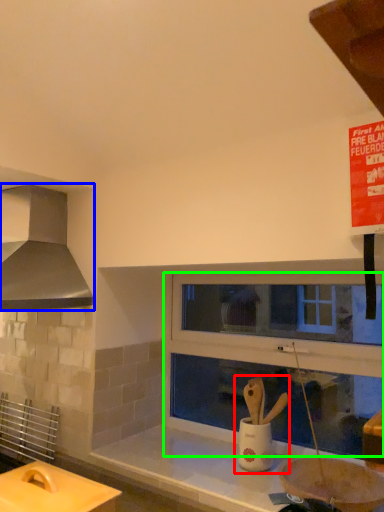
Question: Which is nearer to the sink (highlighted by a red box)? kitchen appliance (highlighted by a blue box) or window frame (highlighted by a green box).

Choices:
 (A) kitchen appliance
 (B) window frame

Answer: (B)